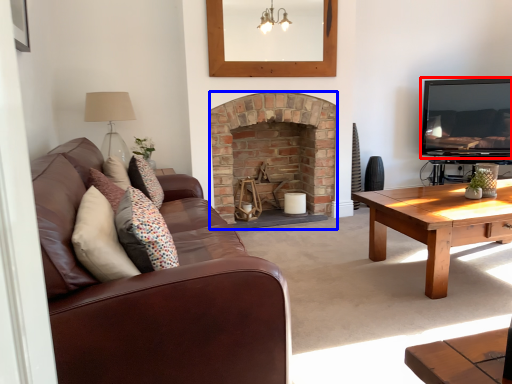
Question: Which object is further to the camera taking this photo, television (highlighted by a red box) or fireplace (highlighted by a blue box)?

Choices:
 (A) television
 (B) fireplace

Answer: (A)